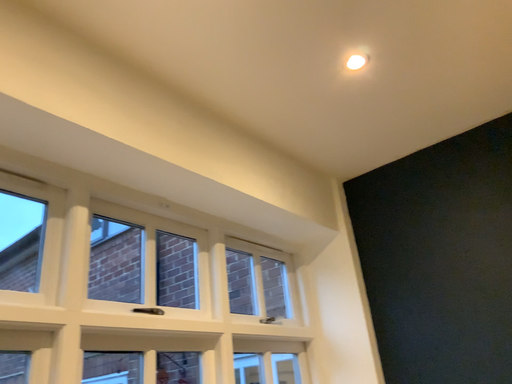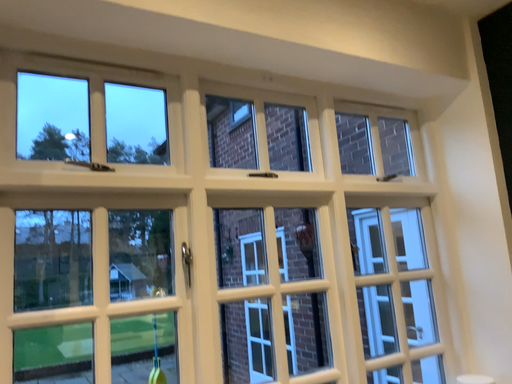
Question: Which way did the camera rotate in the video?

Choices:
 (A) rotated upward
 (B) rotated downward

Answer: (B)